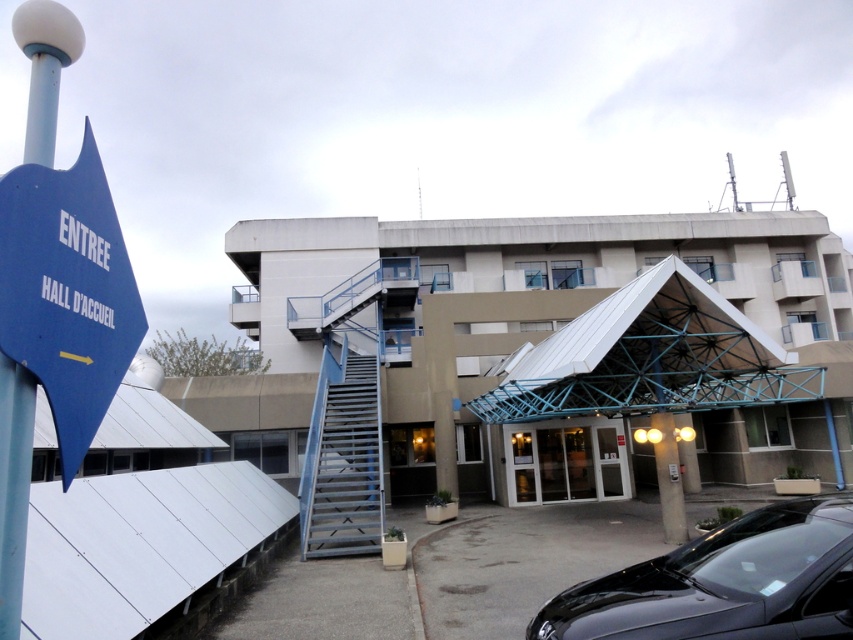
Is blue plastic sign at left positioned behind blue plastic signpost at left?

Yes, it is behind blue plastic signpost at left.

Is point (85, 122) more distant than point (4, 480)?

Yes, it is behind point (4, 480).

Which is in front, point (100, 348) or point (48, 0)?

Point (48, 0) is more forward.

Where is `blue plastic sign at left`? The width and height of the screenshot is (853, 640). blue plastic sign at left is located at coordinates (67, 292).

Which is in front, point (840, 632) or point (576, 484)?

Point (840, 632)

Does black glossy car at lower right appear over white glass doors at center?

Indeed, black glossy car at lower right is positioned over white glass doors at center.

Is point (734, 531) more distant than point (525, 500)?

No, it is in front of (525, 500).

Find the location of a particular element. black glossy car at lower right is located at coordinates (721, 582).

Is blue plastic signpost at left bigger than white glass doors at center?

Yes, blue plastic signpost at left is bigger than white glass doors at center.

Does blue plastic signpost at left appear under white glass doors at center?

No, blue plastic signpost at left is not below white glass doors at center.

What are the coordinates of `blue plastic signpost at left` in the screenshot? It's located at (13, 486).